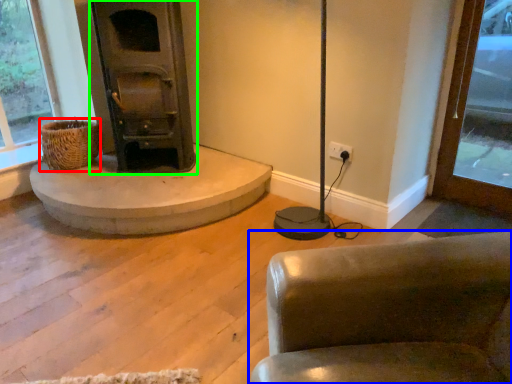
Question: Which object is the closest to the basket (highlighted by a red box)? Choose among these: chair (highlighted by a blue box) or wood burning stove (highlighted by a green box).

Choices:
 (A) chair
 (B) wood burning stove

Answer: (B)